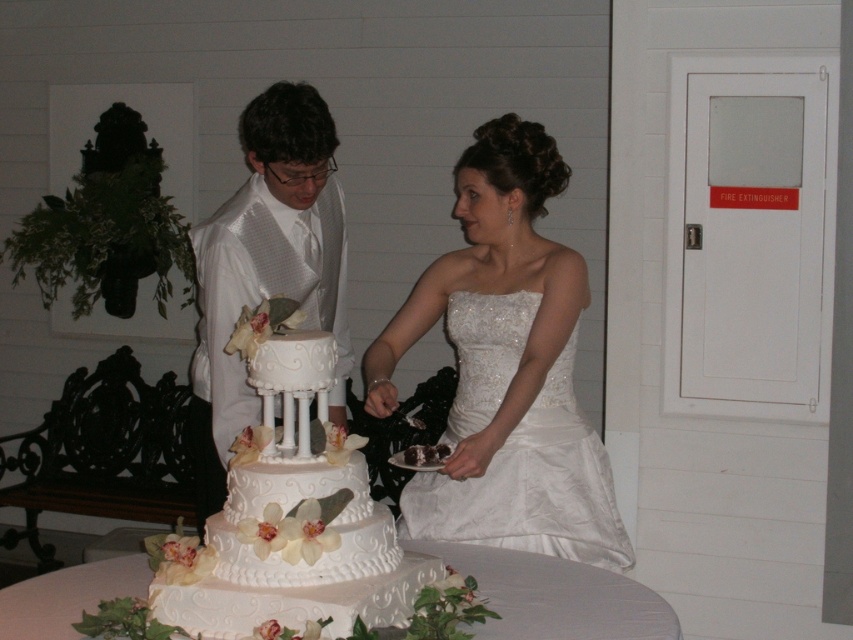
Question: Which point is closer to the camera taking this photo?

Choices:
 (A) (357, 612)
 (B) (419, 493)
 (C) (529, 616)

Answer: (A)

Question: Does white satin suit at center have a larger size compared to white textured cake at center?

Choices:
 (A) no
 (B) yes

Answer: (B)

Question: Can you confirm if white satin dress at center is smaller than white satin suit at center?

Choices:
 (A) no
 (B) yes

Answer: (A)

Question: Among these objects, which one is farthest from the camera?

Choices:
 (A) white satin suit at center
 (B) white glossy wedding cake at center
 (C) white textured cake at center
 (D) white satin dress at center

Answer: (A)

Question: Which object is closer to the camera taking this photo?

Choices:
 (A) white glossy wedding cake at center
 (B) white satin dress at center
 (C) white satin suit at center
 (D) white textured cake at center

Answer: (A)

Question: Is white satin dress at center closer to camera compared to white textured cake at center?

Choices:
 (A) no
 (B) yes

Answer: (A)